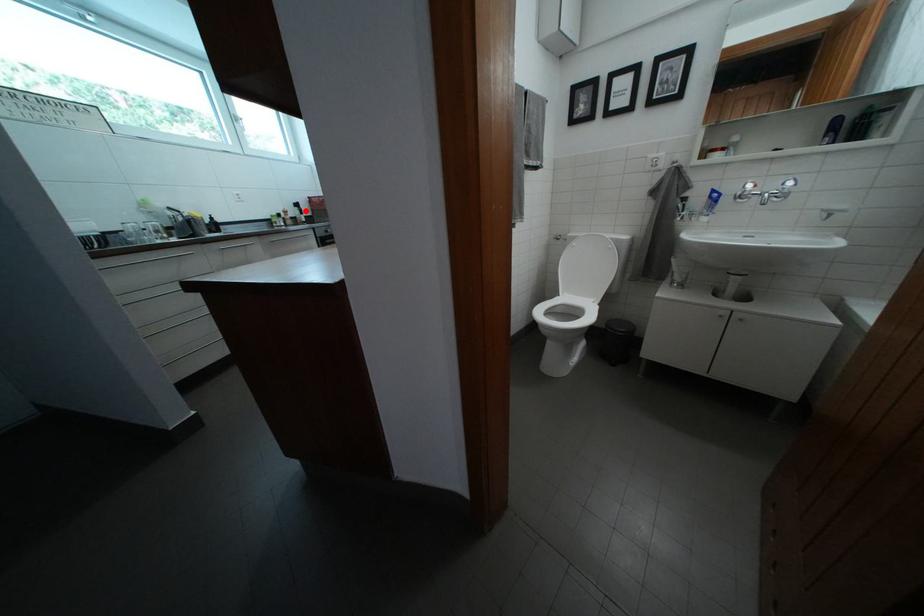
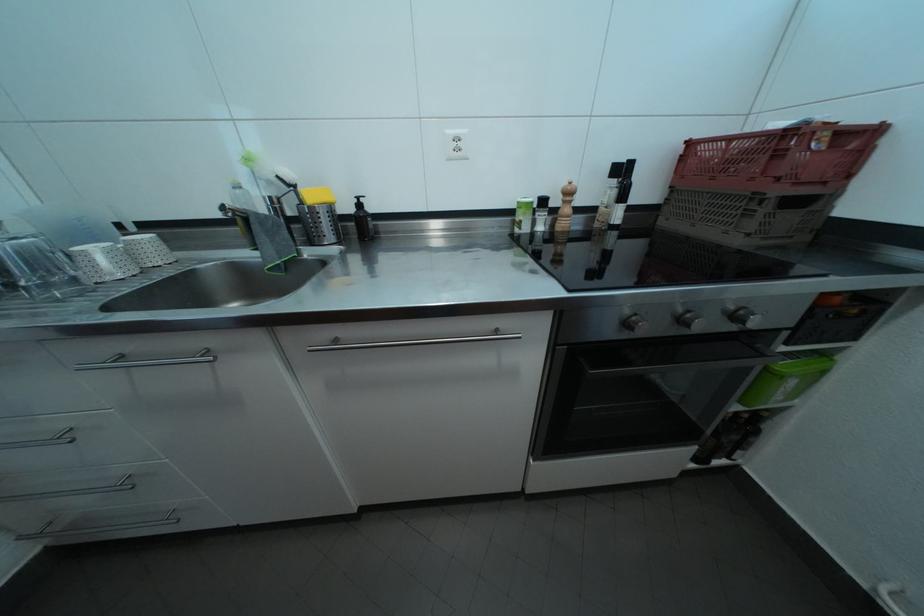
In the second image, find the point that corresponds to the highlighted location in the first image.

(630, 176)